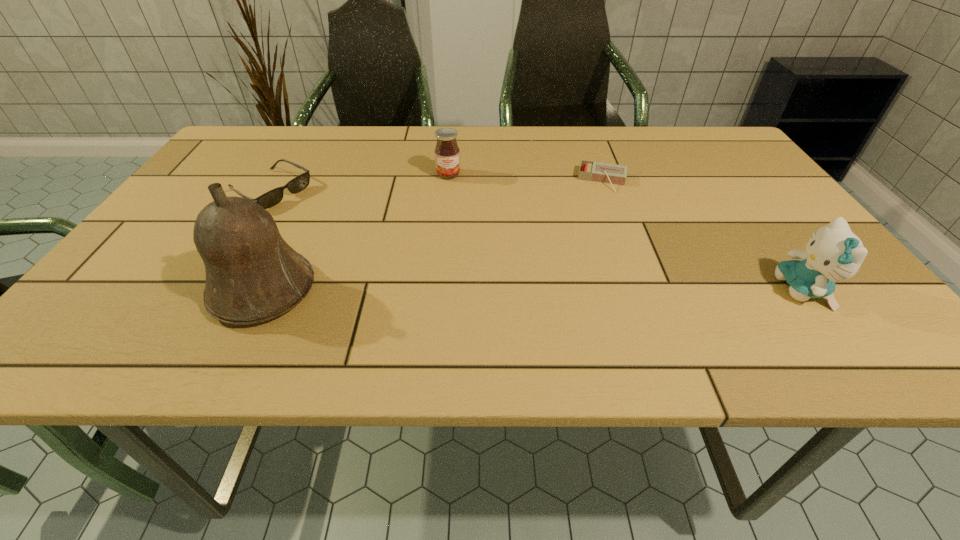
This screenshot has width=960, height=540. I want to click on free point between the fourth object from left to right and the fourth tallest object, so click(437, 185).

Where is `free point between the rightmost object and the shortest object`? The image size is (960, 540). free point between the rightmost object and the shortest object is located at coordinates (703, 235).

Image resolution: width=960 pixels, height=540 pixels. I want to click on free space between the kitten and the sunglasses, so click(x=537, y=240).

Identify the location of free spot between the tallest object and the fourth shortest object. (534, 291).

The height and width of the screenshot is (540, 960). What are the coordinates of `unoccupied position between the matchbox and the fourth tallest object` in the screenshot? It's located at (437, 185).

Find the location of a particular element. The height and width of the screenshot is (540, 960). vacant area that lies between the shortest object and the jam is located at coordinates (526, 178).

Find the location of a particular element. The width and height of the screenshot is (960, 540). vacant space that's between the tallest object and the fourth shortest object is located at coordinates (534, 291).

At what (x,y) coordinates should I click in order to perform the action: click on empty location between the sunglasses and the shortest object. Please return your answer as a coordinate pair (x, y). The width and height of the screenshot is (960, 540). Looking at the image, I should click on (437, 185).

Find the location of a particular element. vacant area between the rightmost object and the sunglasses is located at coordinates (537, 240).

Locate which object is the second closest to the rightmost object. Please provide its 2D coordinates. Your answer should be formatted as a tuple, i.e. [(x, y)], where the tuple contains the x and y coordinates of a point satisfying the conditions above.

[(447, 153)]